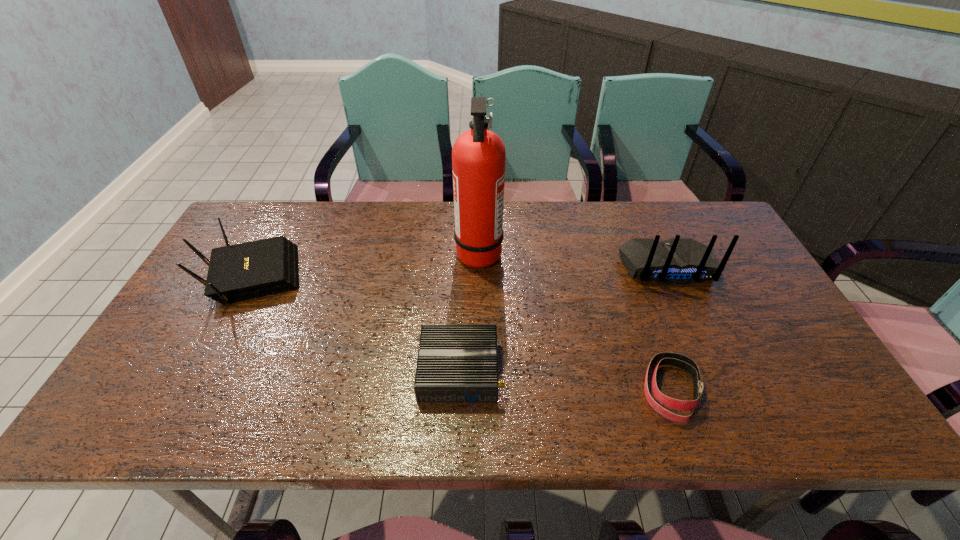
I want to click on vacant space located on the front of the second shortest router, so click(198, 378).

I want to click on blank space located on the back panel of the shortest router, so click(x=631, y=370).

You are a GUI agent. You are given a task and a screenshot of the screen. Output one action in this format:
    pyautogui.click(x=<x>, y=<y>)
    Task: Click on the vacant position located 0.150m on the back of the shortest object
    
    Given the screenshot: What is the action you would take?
    pyautogui.click(x=644, y=312)

Where is `fire extinguisher at the far edge`? This screenshot has height=540, width=960. fire extinguisher at the far edge is located at coordinates (478, 155).

You are a GUI agent. You are given a task and a screenshot of the screen. Output one action in this format:
    pyautogui.click(x=<x>, y=<y>)
    Task: Click on the router that is at the near edge
    This screenshot has width=960, height=540.
    Given the screenshot: What is the action you would take?
    pyautogui.click(x=456, y=362)

I want to click on dog collar present at the near edge, so click(x=683, y=362).

The height and width of the screenshot is (540, 960). In order to click on object at the left edge in this screenshot , I will do `click(244, 271)`.

Locate an element on the screen. This screenshot has height=540, width=960. object that is at the right edge is located at coordinates (677, 261).

The image size is (960, 540). Identify the location of object at the far left corner. (244, 271).

Identify the location of object that is at the far right corner. (677, 261).